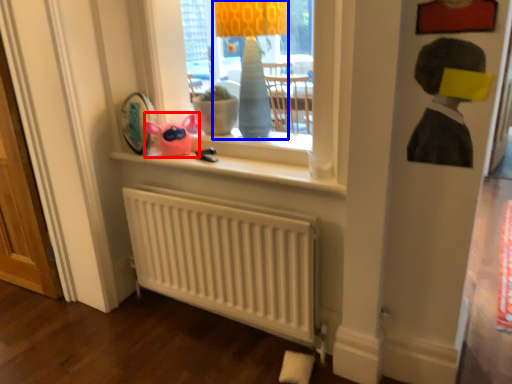
Question: Which point is closer to the camera, toy (highlighted by a red box) or table lamp (highlighted by a blue box)?

Choices:
 (A) toy
 (B) table lamp

Answer: (B)